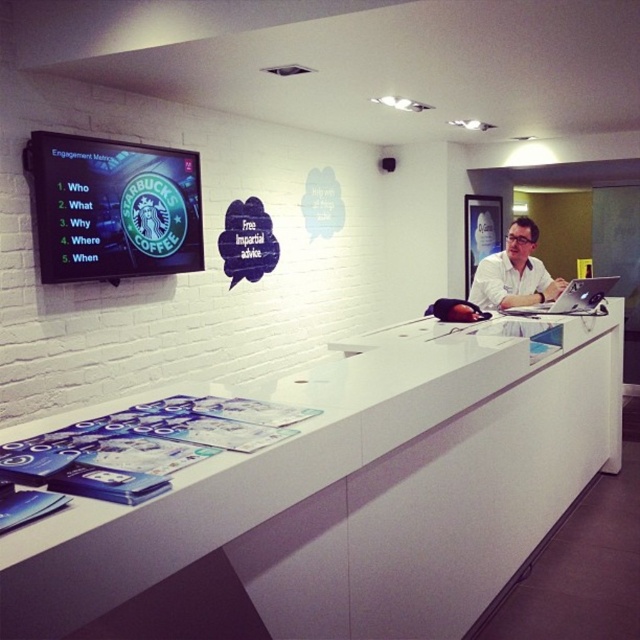
Does white glossy counter at center appear on the right side of sleek silver laptop at center?

Incorrect, white glossy counter at center is not on the right side of sleek silver laptop at center.

Who is more distant from viewer, [294,532] or [602,276]?

The point [602,276] is more distant.

Where is `white glossy counter at center`? white glossy counter at center is located at coordinates (324, 490).

Consider the image. Is white glossy counter at center thinner than white smooth shirt at center?

No, white glossy counter at center is not thinner than white smooth shirt at center.

Is white glossy counter at center to the left of white smooth shirt at center from the viewer's perspective?

Correct, you'll find white glossy counter at center to the left of white smooth shirt at center.

Where is `white glossy counter at center`? Image resolution: width=640 pixels, height=640 pixels. white glossy counter at center is located at coordinates (324, 490).

Find the location of a particular element. white glossy counter at center is located at coordinates (324, 490).

Between point (531, 248) and point (577, 314), which one is positioned behind?

The point (531, 248) is behind.

Where is `white smooth shirt at center`? Image resolution: width=640 pixels, height=640 pixels. white smooth shirt at center is located at coordinates (515, 273).